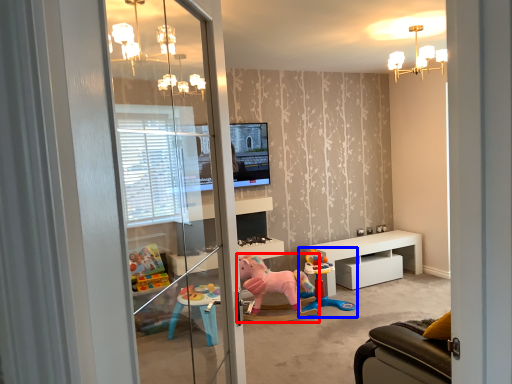
Question: Which object appears farthest to the camera in this image, toy (highlighted by a red box) or toy (highlighted by a blue box)?

Choices:
 (A) toy
 (B) toy

Answer: (B)